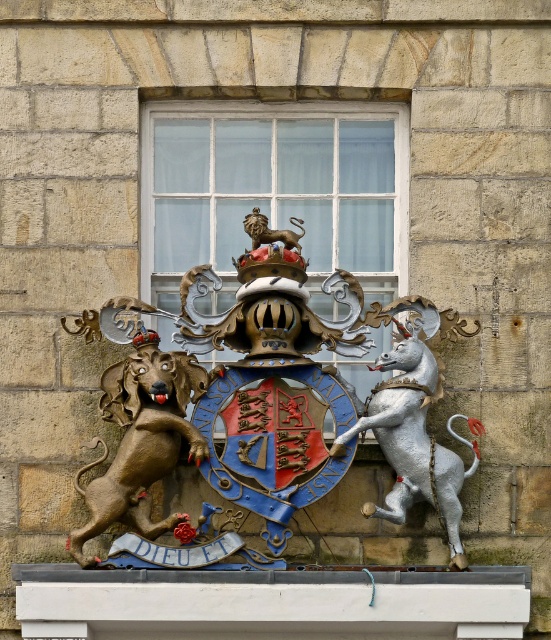
You are an art conservator examining the coat of arms. You need to determine if the polished bronze lion at center can be moved to the position currently occupied by the silver metallic unicorn at right without overlapping. Based on their widths, is this possible?

The polished bronze lion at center might be wider than silver metallic unicorn at right, so moving it to the unicorn position might cause overlapping. Check their exact widths before proceeding.